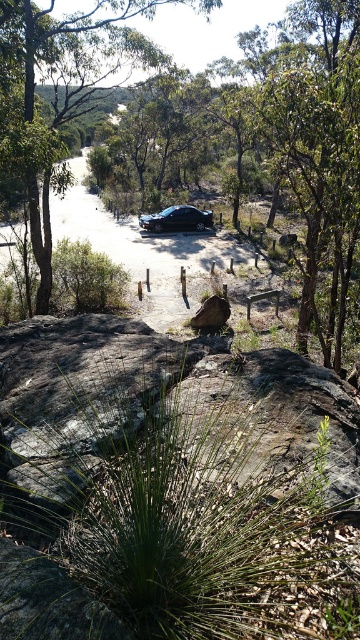
Question: From the image, what is the correct spatial relationship of green leafy tree at center in relation to shiny black car at center?

Choices:
 (A) right
 (B) left

Answer: (B)

Question: Which point appears closest to the camera in this image?

Choices:
 (A) (205, 320)
 (B) (191, 228)

Answer: (A)

Question: Which point appears closest to the camera in this image?

Choices:
 (A) (45, 248)
 (B) (204, 308)

Answer: (B)

Question: Which object appears closest to the camera in this image?

Choices:
 (A) green leafy tree at center
 (B) brown rough boulder at center
 (C) shiny black car at center

Answer: (A)

Question: Is shiny black car at center thinner than brown rough boulder at center?

Choices:
 (A) yes
 (B) no

Answer: (B)

Question: Is green leafy tree at center further to camera compared to brown rough boulder at center?

Choices:
 (A) no
 (B) yes

Answer: (A)